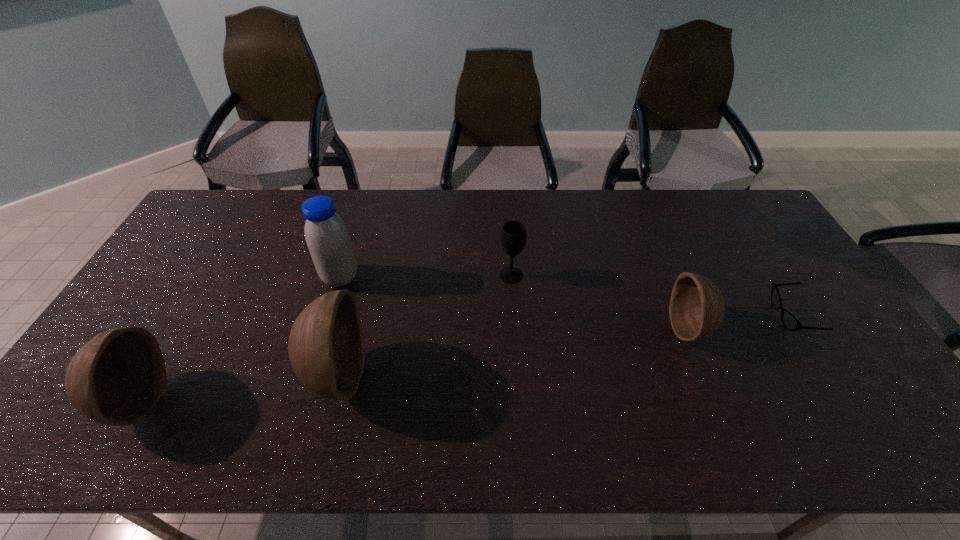
Image resolution: width=960 pixels, height=540 pixels. Identify the location of vacant region located 0.390m on the right of the second bowl from left to right. (517, 374).

The width and height of the screenshot is (960, 540). In order to click on free space located on the back of the rightmost bowl in this screenshot , I will do `click(653, 240)`.

In order to click on vacant space located on the right of the soya milk in this screenshot , I will do `click(461, 278)`.

Find the location of a particular element. Image resolution: width=960 pixels, height=540 pixels. vacant space located 0.330m on the back of the third object from right to left is located at coordinates (506, 204).

Image resolution: width=960 pixels, height=540 pixels. Identify the location of vacant space located 0.230m on the front-facing side of the rightmost object. (693, 316).

Find the location of `blank area located on the front-facing side of the rightmost object`. blank area located on the front-facing side of the rightmost object is located at coordinates (750, 316).

Find the location of a particular element. The width and height of the screenshot is (960, 540). vacant space situated 0.150m on the front-facing side of the rightmost object is located at coordinates (721, 316).

This screenshot has width=960, height=540. I want to click on object that is at the left edge, so click(x=116, y=378).

Where is `object present at the right edge`? This screenshot has height=540, width=960. object present at the right edge is located at coordinates (790, 322).

This screenshot has width=960, height=540. What are the coordinates of `object at the near left corner` in the screenshot? It's located at (116, 378).